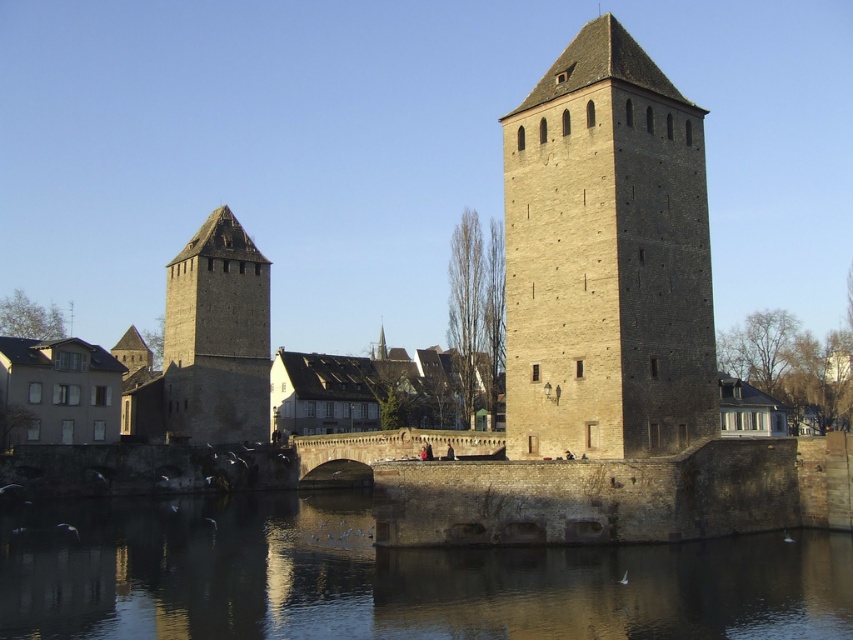
Between beige stone tower at center and brown stone tower at left, which one appears on the left side from the viewer's perspective?

Positioned to the left is brown stone tower at left.

Who is more distant from viewer, (x=634, y=125) or (x=231, y=403)?

Positioned behind is point (x=231, y=403).

Find the location of a particular element. The height and width of the screenshot is (640, 853). beige stone tower at center is located at coordinates (606, 259).

Which is more to the right, smooth stone water at lower center or beige stone tower at center?

beige stone tower at center is more to the right.

Can you confirm if smooth stone water at lower center is positioned to the left of beige stone tower at center?

Yes, smooth stone water at lower center is to the left of beige stone tower at center.

Measure the distance between point (376,561) and camera.

They are 46.46 meters apart.

Find the location of a particular element. smooth stone water at lower center is located at coordinates coord(390,579).

Which is more to the right, smooth stone water at lower center or brown stone tower at left?

Positioned to the right is smooth stone water at lower center.

Who is shorter, smooth stone water at lower center or brown stone tower at left?

With less height is smooth stone water at lower center.

Describe the element at coordinates (390, 579) in the screenshot. The width and height of the screenshot is (853, 640). I see `smooth stone water at lower center` at that location.

The height and width of the screenshot is (640, 853). I want to click on smooth stone water at lower center, so click(390, 579).